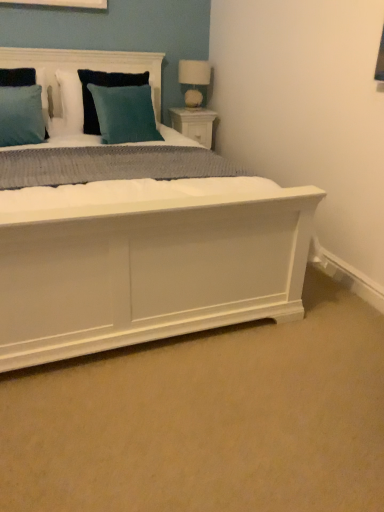
Question: Is teal fabric pillow at upper center wider or thinner than white fabric lampshade at upper right?

Choices:
 (A) wide
 (B) thin

Answer: (A)

Question: From the image's perspective, is teal fabric pillow at upper center above or below white fabric lampshade at upper right?

Choices:
 (A) above
 (B) below

Answer: (B)

Question: Which is nearer to the teal velvet pillow at upper center, which appears as the second pillow when viewed from the back?

Choices:
 (A) white fabric lampshade at upper right
 (B) white wood nightstand at upper right
 (C) teal fabric pillow at upper left, positioned as the 1th pillow in front-to-back order
 (D) teal fabric pillow at upper center
 (E) teal fabric pillow at upper center, the third pillow positioned from the front

Answer: (E)

Question: Based on their relative distances, which object is farther from the teal fabric pillow at upper left, which is the 3th pillow from back to front?

Choices:
 (A) white fabric lampshade at upper right
 (B) teal velvet pillow at upper center, which is counted as the 2th pillow, starting from the front
 (C) teal fabric pillow at upper center, arranged as the first pillow when viewed from the back
 (D) white wood nightstand at upper right
 (E) teal fabric pillow at upper center

Answer: (A)